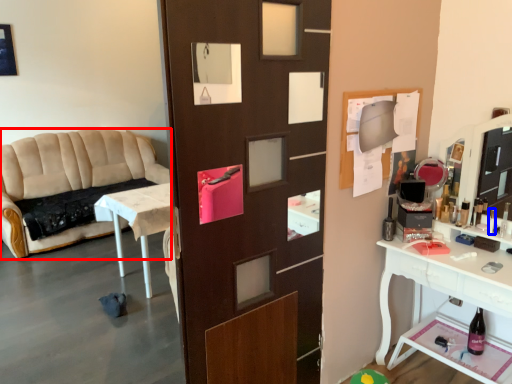
Question: Which of the following is the closest to the observer, studio couch (highlighted by a red box) or toiletry (highlighted by a blue box)?

Choices:
 (A) studio couch
 (B) toiletry

Answer: (B)